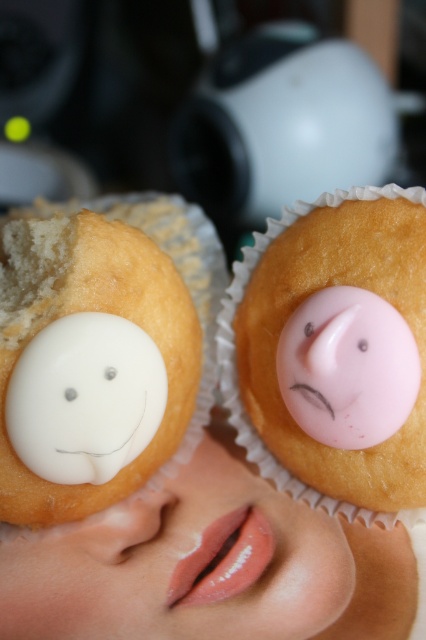
Question: Based on their relative distances, which object is farther from the pink matte nose at center?

Choices:
 (A) white glossy muffin at left
 (B) white glossy frosting at center
 (C) white matte/soft eye at center
 (D) pink glossy frosting at right

Answer: (C)

Question: Which object is positioned closest to the pink matte nose at center?

Choices:
 (A) pink glossy frosting at right
 (B) pink glossy frosting at center
 (C) white glossy muffin at left
 (D) white glossy frosting at center

Answer: (D)

Question: Considering the real-world distances, which object is closest to the white matte/soft eye at center?

Choices:
 (A) pink glossy frosting at right
 (B) pink matte/soft eye at center
 (C) pink glossy frosting at center
 (D) white glossy muffin at left

Answer: (D)

Question: Can you confirm if pink matte nose at center is positioned to the left of white matte/soft eye at center?

Choices:
 (A) no
 (B) yes

Answer: (A)

Question: Considering the relative positions of pink glossy frosting at right and pink glossy frosting at center in the image provided, where is pink glossy frosting at right located with respect to pink glossy frosting at center?

Choices:
 (A) below
 (B) above

Answer: (A)

Question: Can you confirm if white glossy muffin at left is positioned to the left of white matte/soft eye at center?

Choices:
 (A) no
 (B) yes

Answer: (A)